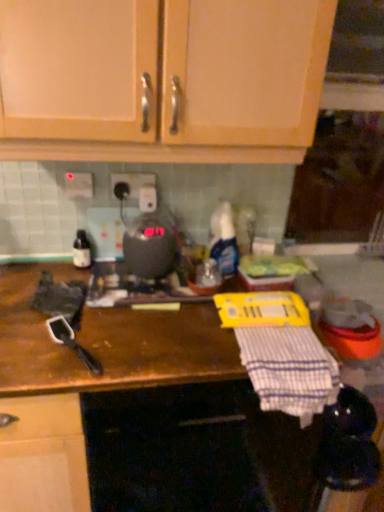
Question: Should I look upward or downward to see translucent plastic spray bottle at center, acting as the second bottle starting from the left?

Choices:
 (A) up
 (B) down

Answer: (A)

Question: Does white plastic electric outlet at upper center, arranged as the 2th electric outlet when viewed from the right, have a smaller size compared to brown wooden countertop at center?

Choices:
 (A) no
 (B) yes

Answer: (B)

Question: Is white plastic electric outlet at upper center, the 1th electric outlet positioned from the left, with brown wooden countertop at center?

Choices:
 (A) yes
 (B) no

Answer: (B)

Question: Does white plastic electric outlet at upper center, the 1th electric outlet positioned from the left, appear on the right side of brown wooden countertop at center?

Choices:
 (A) yes
 (B) no

Answer: (B)

Question: Is white plastic electric outlet at upper center, arranged as the 2th electric outlet when viewed from the right, aimed at brown wooden countertop at center?

Choices:
 (A) yes
 (B) no

Answer: (B)

Question: Considering the relative sizes of white plastic electric outlet at upper center, arranged as the 2th electric outlet when viewed from the right, and brown wooden countertop at center in the image provided, is white plastic electric outlet at upper center, arranged as the 2th electric outlet when viewed from the right, wider than brown wooden countertop at center?

Choices:
 (A) yes
 (B) no

Answer: (B)

Question: Is white plastic electric outlet at upper center, the 1th electric outlet positioned from the left, positioned with its back to brown wooden countertop at center?

Choices:
 (A) no
 (B) yes

Answer: (A)

Question: Is brown wooden countertop at center looking in the opposite direction of white plastic electric outlet at center, the 2th electric outlet positioned from the left?

Choices:
 (A) no
 (B) yes

Answer: (A)

Question: From a real-world perspective, is brown wooden countertop at center below white plastic electric outlet at center, the 1th electric outlet in the right-to-left sequence?

Choices:
 (A) yes
 (B) no

Answer: (A)

Question: Does brown wooden countertop at center have a lesser height compared to white plastic electric outlet at center, the 1th electric outlet in the right-to-left sequence?

Choices:
 (A) no
 (B) yes

Answer: (A)

Question: Could you tell me if brown wooden countertop at center is turned towards white plastic electric outlet at center, the 2th electric outlet positioned from the left?

Choices:
 (A) no
 (B) yes

Answer: (A)

Question: Is brown wooden countertop at center not inside white plastic electric outlet at center, the 1th electric outlet in the right-to-left sequence?

Choices:
 (A) yes
 (B) no

Answer: (A)

Question: Is the depth of brown wooden countertop at center greater than that of white plastic electric outlet at center, the 2th electric outlet positioned from the left?

Choices:
 (A) yes
 (B) no

Answer: (B)

Question: From the image's perspective, is wooden cabinet doors at upper center below white plastic electric outlet at center, the 2th electric outlet positioned from the left?

Choices:
 (A) no
 (B) yes

Answer: (A)